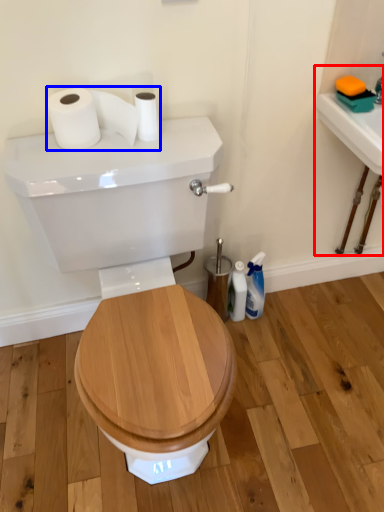
Question: Which point is closer to the camera, sink (highlighted by a red box) or toilet paper (highlighted by a blue box)?

Choices:
 (A) sink
 (B) toilet paper

Answer: (B)